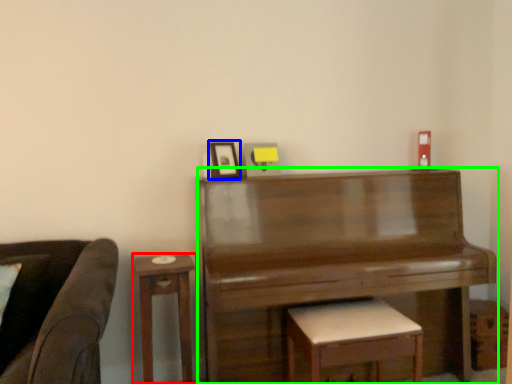
Question: Based on their relative distances, which object is nearer to table (highlighted by a red box)? Choose from picture frame (highlighted by a blue box) and piano (highlighted by a green box).

Choices:
 (A) picture frame
 (B) piano

Answer: (A)